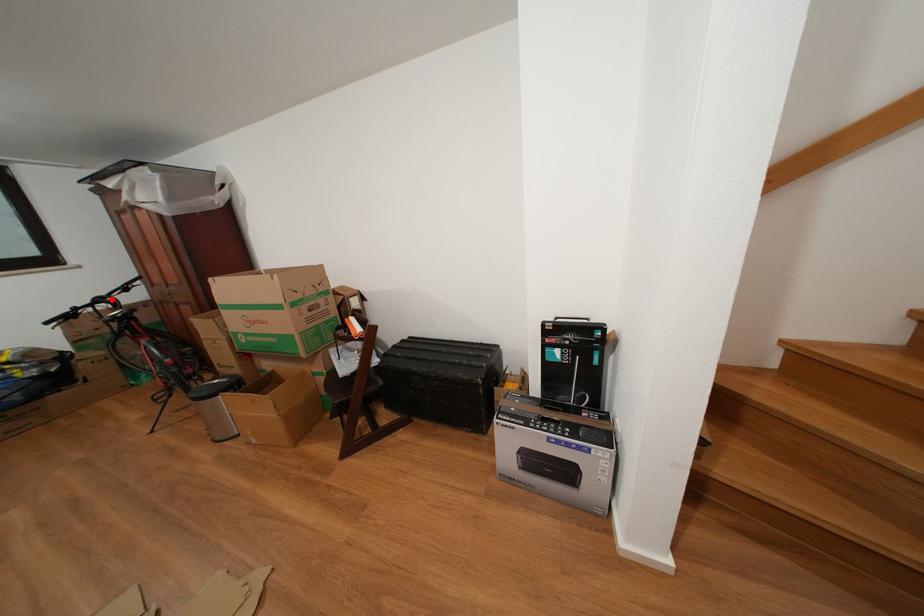
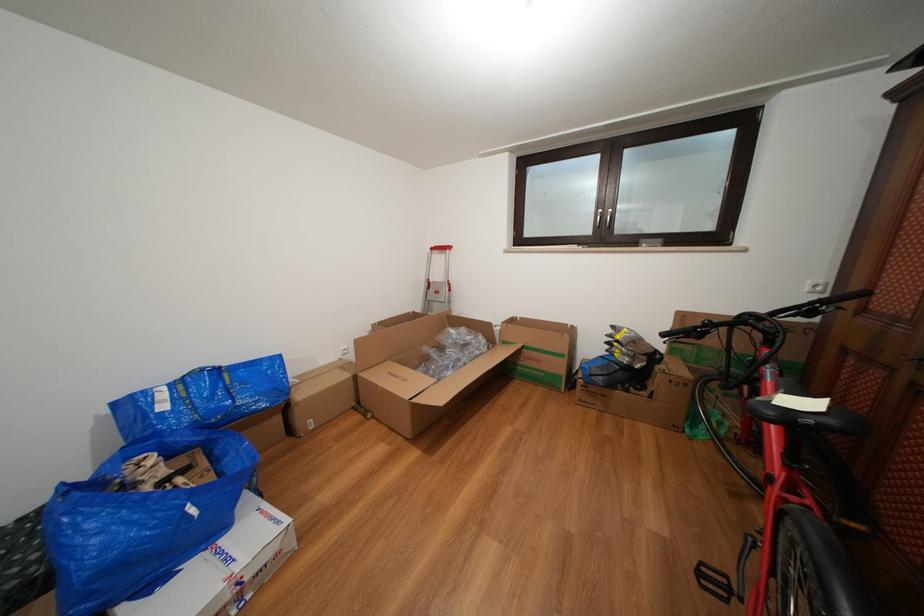
Where in the second image is the point corresponding to the highlighted location from the first image?

(772, 315)